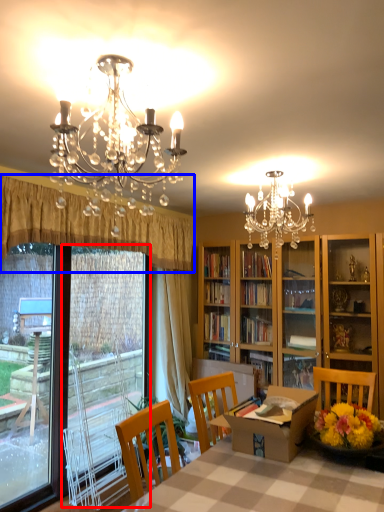
Question: Which point is closer to the camera, screen door (highlighted by a red box) or curtain (highlighted by a blue box)?

Choices:
 (A) screen door
 (B) curtain

Answer: (B)